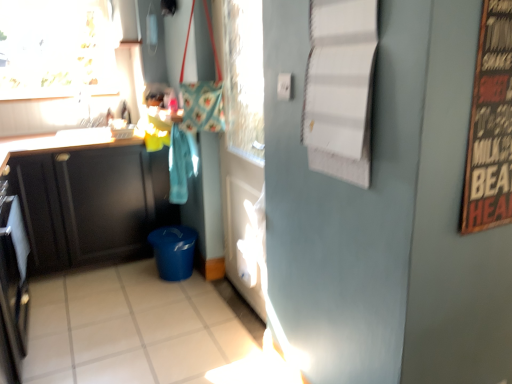
The height and width of the screenshot is (384, 512). What are the coordinates of `vacant area that lies between black stainless steel oven at left and white glossy door at center` in the screenshot? It's located at 140,315.